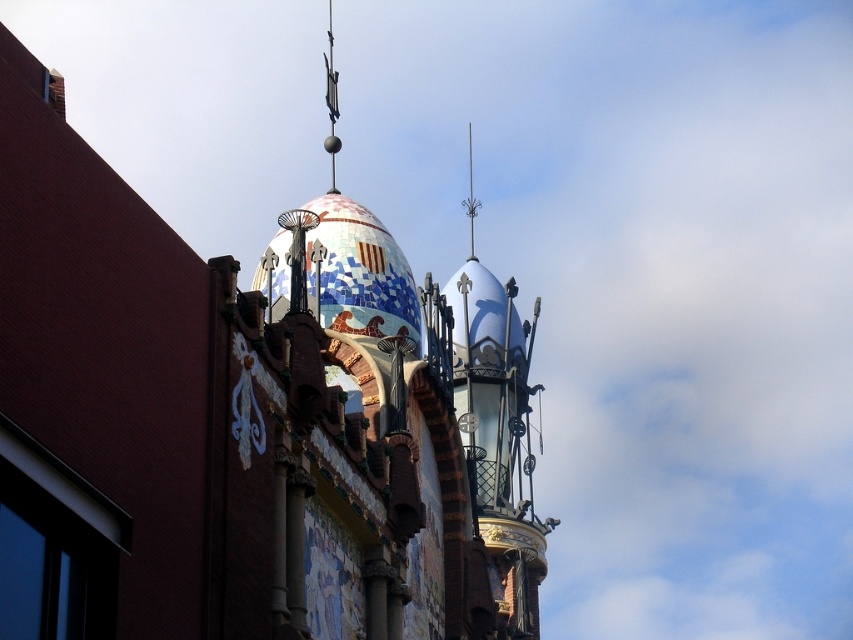
Does point (332, 67) come farther from viewer compared to point (468, 209)?

Yes, point (332, 67) is behind point (468, 209).

Is metallic spire at upper center closer to the viewer compared to metallic silver spire at upper center?

Yes, metallic spire at upper center is closer to the viewer.

Is point (329, 115) positioned behind point (468, 204)?

No, (329, 115) is closer to viewer.

Image resolution: width=853 pixels, height=640 pixels. Find the location of `metallic spire at upper center`. metallic spire at upper center is located at coordinates (331, 100).

Does white glossy dome at upper center appear under metallic silver spire at upper center?

Correct, white glossy dome at upper center is located below metallic silver spire at upper center.

Is point (466, 376) closer to camera compared to point (471, 172)?

Yes, it is in front of point (471, 172).

Locate an element on the screen. white glossy dome at upper center is located at coordinates (498, 440).

What do you see at coordinates (498, 440) in the screenshot? I see `white glossy dome at upper center` at bounding box center [498, 440].

Who is positioned more to the left, white glossy dome at upper center or metallic spire at upper center?

From the viewer's perspective, metallic spire at upper center appears more on the left side.

What do you see at coordinates (498, 440) in the screenshot? I see `white glossy dome at upper center` at bounding box center [498, 440].

I want to click on white glossy dome at upper center, so click(x=498, y=440).